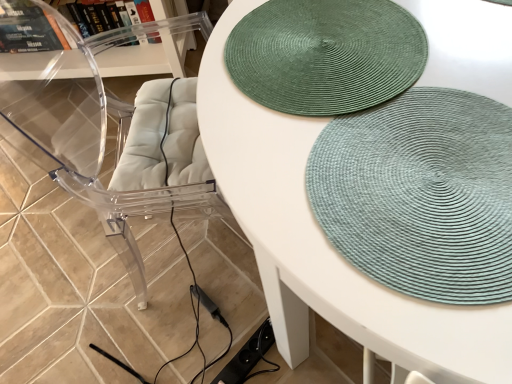
Question: Is transparent acrylic swivel chair at left not within green woven placemat at upper center?

Choices:
 (A) no
 (B) yes

Answer: (B)

Question: From a real-world perspective, does transparent acrylic swivel chair at left sit lower than green woven placemat at upper center?

Choices:
 (A) no
 (B) yes

Answer: (A)

Question: Is transparent acrylic swivel chair at left taller than green woven placemat at upper center?

Choices:
 (A) no
 (B) yes

Answer: (B)

Question: From the image's perspective, does transparent acrylic swivel chair at left appear higher than green woven placemat at upper center?

Choices:
 (A) no
 (B) yes

Answer: (B)

Question: From the image's perspective, is transparent acrylic swivel chair at left below green woven placemat at upper center?

Choices:
 (A) yes
 (B) no

Answer: (B)

Question: Considering the relative positions of green woven mat at upper right, the first mat in the bottom-to-top sequence, and green woven mat at upper center, the 2th mat ordered from the bottom, in the image provided, is green woven mat at upper right, the first mat in the bottom-to-top sequence, to the left or to the right of green woven mat at upper center, the 2th mat ordered from the bottom,?

Choices:
 (A) left
 (B) right

Answer: (B)

Question: From a real-world perspective, relative to green woven mat at upper center, the 2th mat ordered from the bottom, is green woven mat at upper right, marked as the second mat in a top-to-bottom arrangement, vertically above or below?

Choices:
 (A) above
 (B) below

Answer: (B)

Question: Is green woven mat at upper right, the first mat in the bottom-to-top sequence, taller or shorter than green woven mat at upper center, which is the first mat from top to bottom?

Choices:
 (A) short
 (B) tall

Answer: (B)

Question: Considering the positions of green woven mat at upper right, the first mat in the bottom-to-top sequence, and green woven mat at upper center, the 2th mat ordered from the bottom, in the image, is green woven mat at upper right, the first mat in the bottom-to-top sequence, wider or thinner than green woven mat at upper center, the 2th mat ordered from the bottom,?

Choices:
 (A) thin
 (B) wide

Answer: (B)

Question: In terms of width, does transparent acrylic swivel chair at left look wider or thinner when compared to green woven mat at upper center, which is the first mat from top to bottom?

Choices:
 (A) wide
 (B) thin

Answer: (A)

Question: Considering their positions, is transparent acrylic swivel chair at left located in front of or behind green woven mat at upper center, the 2th mat ordered from the bottom?

Choices:
 (A) front
 (B) behind

Answer: (A)

Question: From the image's perspective, is transparent acrylic swivel chair at left above or below green woven mat at upper center, which is the first mat from top to bottom?

Choices:
 (A) above
 (B) below

Answer: (B)

Question: From a real-world perspective, is transparent acrylic swivel chair at left above or below green woven mat at upper center, which is the first mat from top to bottom?

Choices:
 (A) above
 (B) below

Answer: (B)

Question: Is transparent acrylic swivel chair at left wider or thinner than transparent plastic shelf at upper left?

Choices:
 (A) wide
 (B) thin

Answer: (A)

Question: Considering their positions, is transparent acrylic swivel chair at left located in front of or behind transparent plastic shelf at upper left?

Choices:
 (A) front
 (B) behind

Answer: (A)